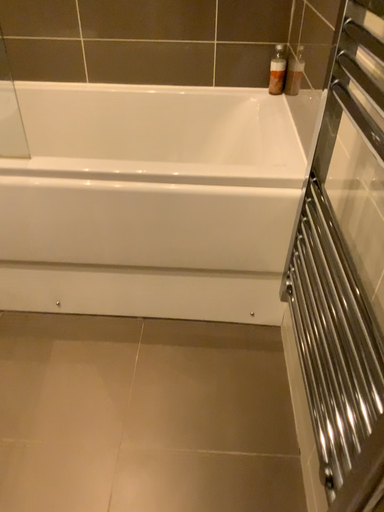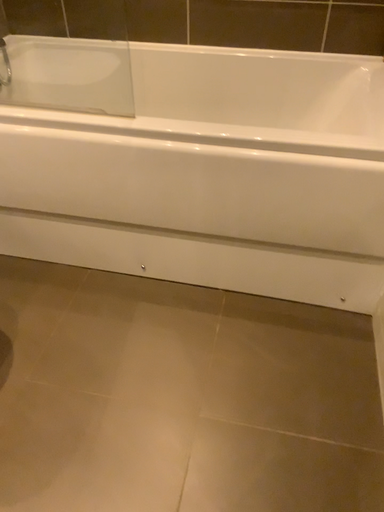
Question: How did the camera likely rotate when shooting the video?

Choices:
 (A) rotated left
 (B) rotated right

Answer: (A)